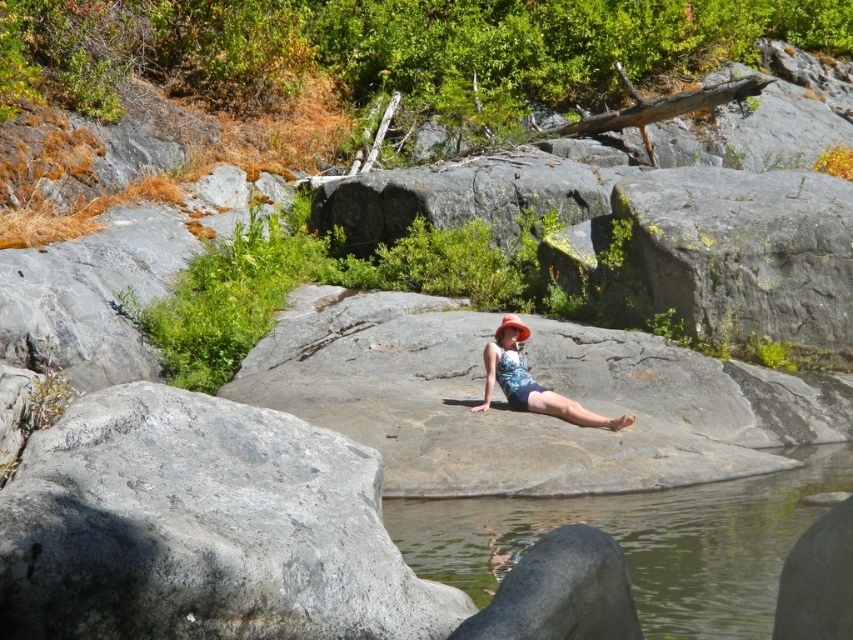
You are a photographer trying to capture the person in the matte floral swimsuit at center. To avoid blocking the view of the water behind them, you need to position yourself so that the gray rough rock at center is not in front of the swimsuit. Is this possible given their current positions?

The gray rough rock at center is positioned under the matte floral swimsuit at center, so moving around to avoid the rock blocking the view would not be possible since the rock is already beneath the swimsuit, not in front of it.

You are a photographer planning to capture the scene with the gray rough rock at center and the matte floral swimsuit at center. You need to ensure that both objects are fully visible in your shot. Based on their sizes, which object should you prioritize positioning closer to the camera to avoid cropping?

The gray rough rock at center might be wider than the matte floral swimsuit at center, so you should prioritize positioning the gray rough rock at center closer to the camera to ensure it fits within the frame without cropping.

Looking at this image, you are a photographer wanting to capture the gray rough rock at center and the matte floral swimsuit at center in a single frame. Based on their sizes, which object would appear larger in the photo?

The gray rough rock at center would appear larger in the photo because it is much taller than the matte floral swimsuit at center.